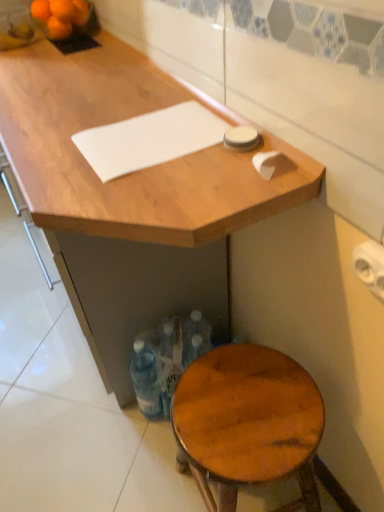
Question: Considering the relative sizes of white matte cutting board at upper center and translucent plastic bottles at lower center in the image provided, is white matte cutting board at upper center taller than translucent plastic bottles at lower center?

Choices:
 (A) yes
 (B) no

Answer: (B)

Question: From the image's perspective, is white matte cutting board at upper center located beneath translucent plastic bottles at lower center?

Choices:
 (A) no
 (B) yes

Answer: (A)

Question: Is white matte cutting board at upper center not near translucent plastic bottles at lower center?

Choices:
 (A) no
 (B) yes

Answer: (A)

Question: Is white matte cutting board at upper center thinner than translucent plastic bottles at lower center?

Choices:
 (A) no
 (B) yes

Answer: (A)

Question: From a real-world perspective, is white matte cutting board at upper center below translucent plastic bottles at lower center?

Choices:
 (A) no
 (B) yes

Answer: (A)

Question: From the image's perspective, is orange matte tangerine at upper left, the 3th tangerine positioned from the front, located above or below orange matte tangerine at upper left, placed as the third tangerine when sorted from back to front?

Choices:
 (A) above
 (B) below

Answer: (A)

Question: Would you say orange matte tangerine at upper left, which ranks as the second tangerine in back-to-front order, is to the left or to the right of orange matte tangerine at upper left, placed as the third tangerine when sorted from back to front, in the picture?

Choices:
 (A) left
 (B) right

Answer: (B)

Question: From a real-world perspective, is orange matte tangerine at upper left, the 3th tangerine positioned from the front, physically located above or below orange matte tangerine at upper left, placed as the third tangerine when sorted from back to front?

Choices:
 (A) below
 (B) above

Answer: (B)

Question: Is point [x=84, y=15] closer or farther from the camera than point [x=51, y=27]?

Choices:
 (A) closer
 (B) farther

Answer: (B)

Question: Looking at the image, does orange matte tangerine at upper left, which ranks as the second tangerine in back-to-front order, seem bigger or smaller compared to orange matte tangerine at upper left, the fourth tangerine in the front-to-back sequence?

Choices:
 (A) small
 (B) big

Answer: (A)

Question: Considering the relative positions of orange matte tangerine at upper left, the 3th tangerine positioned from the front, and orange matte tangerine at upper left, acting as the first tangerine starting from the back, in the image provided, is orange matte tangerine at upper left, the 3th tangerine positioned from the front, to the left or to the right of orange matte tangerine at upper left, acting as the first tangerine starting from the back,?

Choices:
 (A) left
 (B) right

Answer: (B)

Question: In terms of height, does orange matte tangerine at upper left, the 3th tangerine positioned from the front, look taller or shorter compared to orange matte tangerine at upper left, acting as the first tangerine starting from the back?

Choices:
 (A) tall
 (B) short

Answer: (A)

Question: From the image's perspective, relative to orange matte tangerine at upper left, the fourth tangerine in the front-to-back sequence, is orange matte tangerine at upper left, the 3th tangerine positioned from the front, above or below?

Choices:
 (A) above
 (B) below

Answer: (A)

Question: Which is correct: orange matte tangerine at upper left, which is the first tangerine from front to back, is inside translucent plastic bottles at lower center, or outside of it?

Choices:
 (A) outside
 (B) inside

Answer: (A)

Question: In terms of height, does orange matte tangerine at upper left, which is the first tangerine from front to back, look taller or shorter compared to translucent plastic bottles at lower center?

Choices:
 (A) short
 (B) tall

Answer: (A)